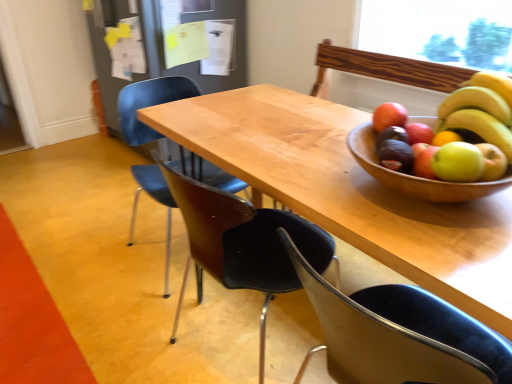
Locate an element on the screen. The height and width of the screenshot is (384, 512). vacant space situated on the left part of matte black chair at center, arranged as the 1th chair when viewed from the back is located at coordinates (90, 252).